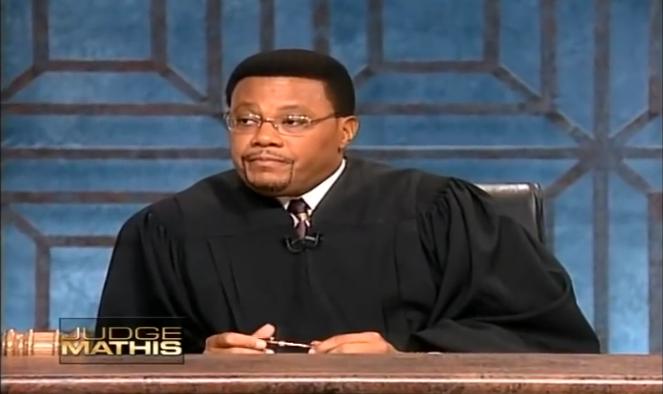
Where is `robe`? The height and width of the screenshot is (394, 663). robe is located at coordinates click(x=383, y=266).